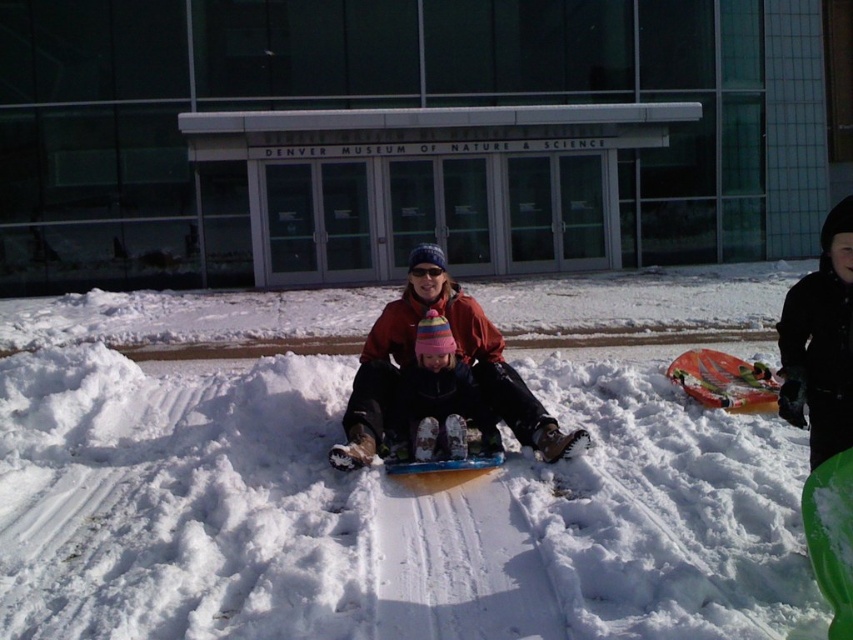
You are planning to build a small snow fort near the Denver Museum of Nature Science. You have two snowboards available for the fort walls. The green plastic snowboard at lower right and the orange plastic snowboard at center. Which snowboard should you choose if you want the taller wall for your fort?

The green plastic snowboard at lower right is taller than the orange plastic snowboard at center, so you should choose the green plastic snowboard at lower right for the taller wall.

You are a delivery robot with a width of 1.2 meters. You need to transport a package from the green plastic snowboard at lower right to the orange plastic snowboard at center. Is there enough space for you to move between these two snowboards without any obstacles?

The distance between the green plastic snowboard at lower right and the orange plastic snowboard at center is 3.72 meters. Since the robot is 1.2 meters wide, there is sufficient space for it to navigate between them as the distance is greater than the robot width.

You are planning to place a 10 feet long banner between the matte red snowboard at center and the green plastic snowboard at lower right. Will the banner fit without overlapping either snowboard?

The distance between the matte red snowboard at center and the green plastic snowboard at lower right is 8.14 feet. Since the banner is 10 feet long, it will overlap both snowboards as it is longer than the available space.